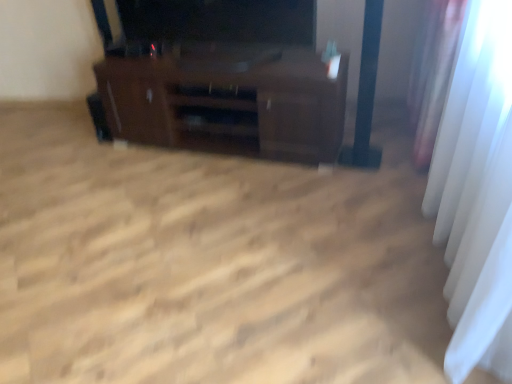
The height and width of the screenshot is (384, 512). Identify the location of free space to the left of dark brown wood tv stand at center. pyautogui.click(x=93, y=177).